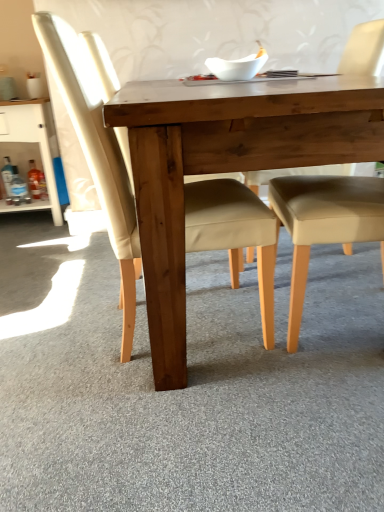
Question: Based on their positions, is white glossy cabinet at left located to the left or right of matte wood chair at center, placed as the second chair when sorted from right to left?

Choices:
 (A) right
 (B) left

Answer: (B)

Question: Is point (44, 99) closer or farther from the camera than point (190, 205)?

Choices:
 (A) farther
 (B) closer

Answer: (A)

Question: Estimate the real-world distances between objects in this image. Which object is closer to the beige leather chair at center, marked as the second chair in a left-to-right arrangement?

Choices:
 (A) natural wood table at center
 (B) white glossy cabinet at left
 (C) matte wood chair at center, which is the 1th chair from left to right

Answer: (A)

Question: Which object is positioned closest to the natural wood table at center?

Choices:
 (A) matte wood chair at center, placed as the second chair when sorted from right to left
 (B) beige leather chair at center, marked as the second chair in a left-to-right arrangement
 (C) white glossy cabinet at left

Answer: (A)